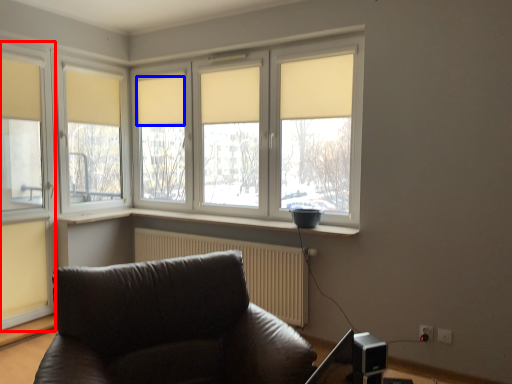
Question: Among these objects, which one is farthest to the camera, window (highlighted by a red box) or curtain (highlighted by a blue box)?

Choices:
 (A) window
 (B) curtain

Answer: (B)